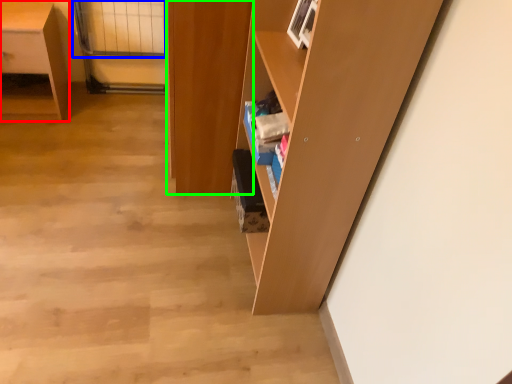
Question: Considering the real-world distances, which object is closest to desk (highlighted by a red box)? glass door (highlighted by a blue box) or cabinetry (highlighted by a green box).

Choices:
 (A) glass door
 (B) cabinetry

Answer: (A)